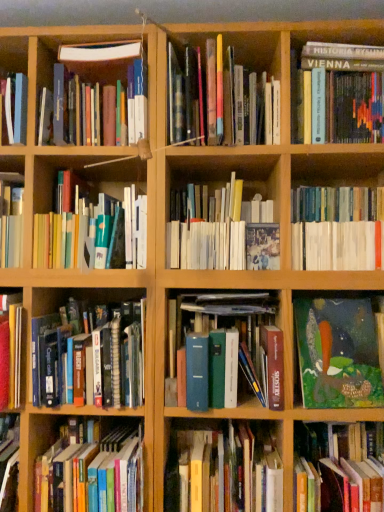
Question: Is green textured painting at lower right, the eighth book in the top-to-bottom sequence, far from matte hardcover books at center left, the 4th book from the top?

Choices:
 (A) yes
 (B) no

Answer: (B)

Question: From the image's perspective, is green textured painting at lower right, which is the fifth book from bottom to top, over matte hardcover books at center left, the 4th book from the top?

Choices:
 (A) yes
 (B) no

Answer: (B)

Question: Is green textured painting at lower right, the eighth book in the top-to-bottom sequence, positioned behind matte hardcover books at center left, marked as the ninth book in a bottom-to-top arrangement?

Choices:
 (A) yes
 (B) no

Answer: (B)

Question: Considering the relative sizes of green textured painting at lower right, the eighth book in the top-to-bottom sequence, and matte hardcover books at center left, the 4th book from the top, in the image provided, is green textured painting at lower right, the eighth book in the top-to-bottom sequence, bigger than matte hardcover books at center left, the 4th book from the top,?

Choices:
 (A) no
 (B) yes

Answer: (A)

Question: Does green textured painting at lower right, which is the fifth book from bottom to top, have a lesser height compared to matte hardcover books at center left, marked as the ninth book in a bottom-to-top arrangement?

Choices:
 (A) no
 (B) yes

Answer: (B)

Question: From a real-world perspective, is hardcover book at lower left, which is the second book in bottom-to-top order, positioned above or below hardcover books at center left, the 6th book from the bottom?

Choices:
 (A) above
 (B) below

Answer: (B)

Question: Considering their positions, is hardcover book at lower left, the 11th book positioned from the top, located in front of or behind hardcover books at center left, which is the 7th book from top to bottom?

Choices:
 (A) front
 (B) behind

Answer: (A)

Question: Visually, is hardcover book at lower left, the 11th book positioned from the top, positioned to the left or to the right of hardcover books at center left, the 6th book from the bottom?

Choices:
 (A) left
 (B) right

Answer: (B)

Question: From the image's perspective, is hardcover book at lower left, which is the second book in bottom-to-top order, above or below hardcover books at center left, the 6th book from the bottom?

Choices:
 (A) above
 (B) below

Answer: (B)

Question: In terms of width, does hardcover book at center, which ranks as the 1th book in bottom-to-top order, look wider or thinner when compared to blue hardcover book at center, arranged as the 9th book when viewed from the top?

Choices:
 (A) thin
 (B) wide

Answer: (B)

Question: Is hardcover book at center, which ranks as the 1th book in bottom-to-top order, taller or shorter than blue hardcover book at center, which ranks as the 4th book in bottom-to-top order?

Choices:
 (A) short
 (B) tall

Answer: (A)

Question: In terms of size, does hardcover book at center, which ranks as the 1th book in bottom-to-top order, appear bigger or smaller than blue hardcover book at center, arranged as the 9th book when viewed from the top?

Choices:
 (A) small
 (B) big

Answer: (A)

Question: Is hardcover book at center, which ranks as the 1th book in bottom-to-top order, in front of or behind blue hardcover book at center, arranged as the 9th book when viewed from the top, in the image?

Choices:
 (A) behind
 (B) front

Answer: (B)

Question: From a real-world perspective, is green matte book at lower right, the 3th book when ordered from bottom to top, physically located above or below hardcover book at lower left, which is the second book in bottom-to-top order?

Choices:
 (A) above
 (B) below

Answer: (A)

Question: Considering their positions, is green matte book at lower right, the tenth book viewed from the top, located in front of or behind hardcover book at lower left, which is the second book in bottom-to-top order?

Choices:
 (A) front
 (B) behind

Answer: (A)